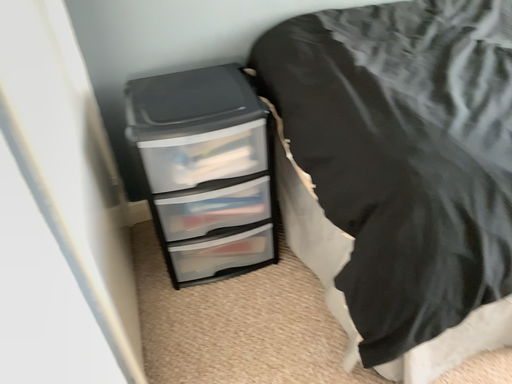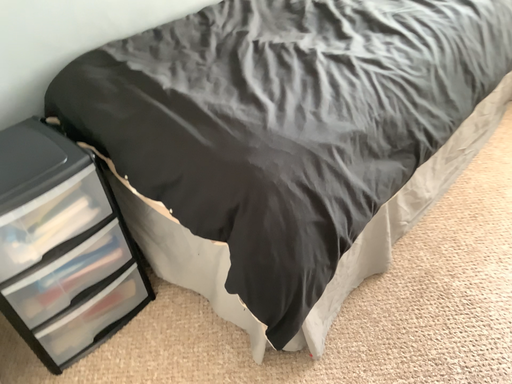
Question: Which way did the camera rotate in the video?

Choices:
 (A) rotated downward
 (B) rotated upward

Answer: (B)